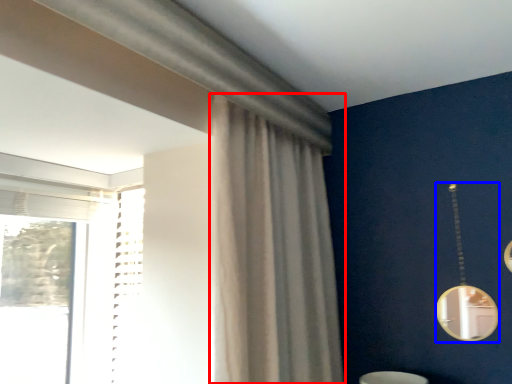
Question: Which point is closer to the camera, curtain (highlighted by a red box) or mirror (highlighted by a blue box)?

Choices:
 (A) curtain
 (B) mirror

Answer: (A)